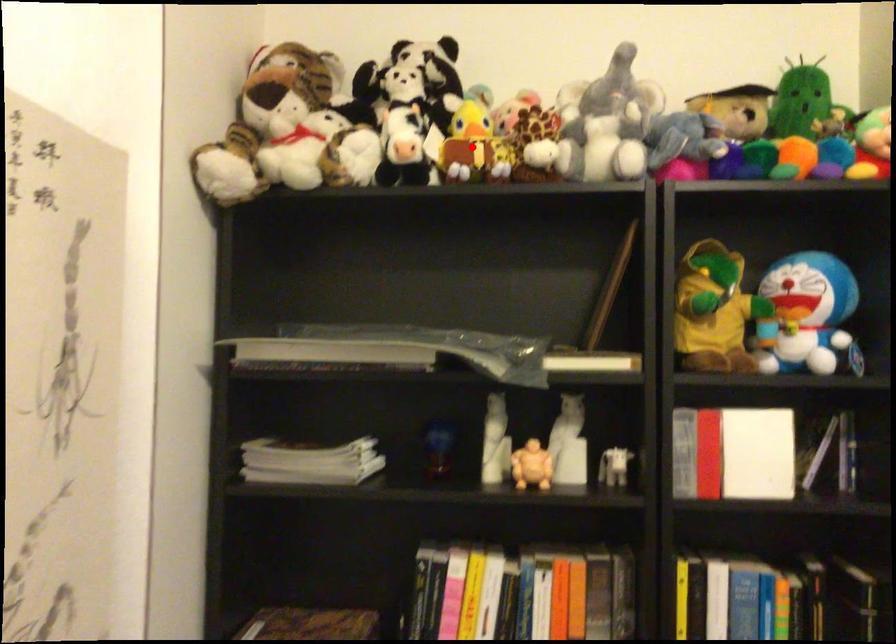
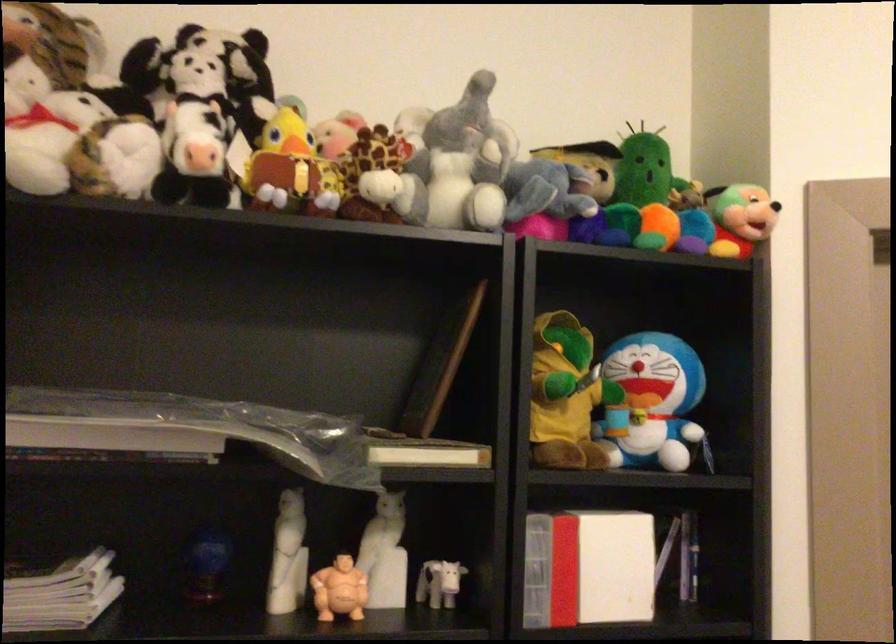
Question: I am providing you with two images of the same scene from different viewpoints. A red point is shown in image1. For the corresponding object point in image2, is it positioned nearer or farther from the camera?

Choices:
 (A) Nearer
 (B) Farther

Answer: (A)